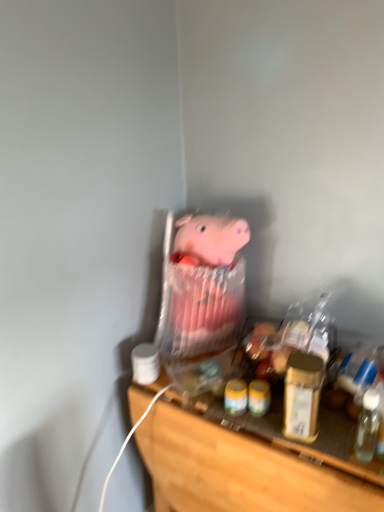
The height and width of the screenshot is (512, 384). What are the coordinates of `vacant space behind transparent plastic bottle at right` in the screenshot? It's located at (332, 417).